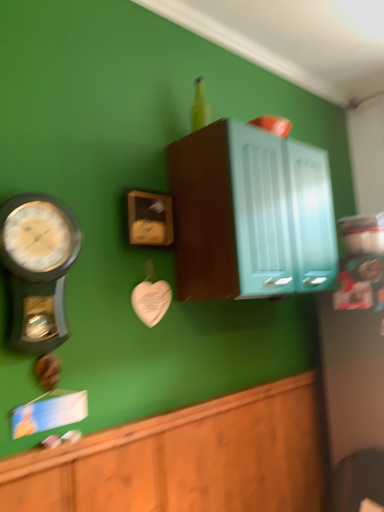
Question: Which direction should I rotate to face teal glossy cabinet at upper center, marked as the 1th cabinetry in a top-to-bottom arrangement, — up or down?

Choices:
 (A) down
 (B) up

Answer: (B)

Question: Considering the relative sizes of metallic silver wall clock at left and teal glossy cabinet at upper center, marked as the 2th cabinetry in a bottom-to-top arrangement, in the image provided, is metallic silver wall clock at left thinner than teal glossy cabinet at upper center, marked as the 2th cabinetry in a bottom-to-top arrangement,?

Choices:
 (A) no
 (B) yes

Answer: (B)

Question: Can you confirm if metallic silver wall clock at left is positioned to the left of teal glossy cabinet at upper center, marked as the 2th cabinetry in a bottom-to-top arrangement?

Choices:
 (A) no
 (B) yes

Answer: (B)

Question: Considering the relative sizes of metallic silver wall clock at left and teal glossy cabinet at upper center, marked as the 2th cabinetry in a bottom-to-top arrangement, in the image provided, is metallic silver wall clock at left taller than teal glossy cabinet at upper center, marked as the 2th cabinetry in a bottom-to-top arrangement,?

Choices:
 (A) yes
 (B) no

Answer: (B)

Question: From a real-world perspective, is metallic silver wall clock at left on teal glossy cabinet at upper center, marked as the 1th cabinetry in a top-to-bottom arrangement?

Choices:
 (A) yes
 (B) no

Answer: (B)

Question: Is metallic silver wall clock at left aimed at teal glossy cabinet at upper center, marked as the 1th cabinetry in a top-to-bottom arrangement?

Choices:
 (A) no
 (B) yes

Answer: (A)

Question: Is the depth of metallic silver wall clock at left greater than that of teal glossy cabinet at upper center, marked as the 1th cabinetry in a top-to-bottom arrangement?

Choices:
 (A) yes
 (B) no

Answer: (B)

Question: Is wooden cabinet at lower center, positioned as the first cabinetry in bottom-to-top order, completely or partially outside of teal glossy cabinet at upper center, marked as the 1th cabinetry in a top-to-bottom arrangement?

Choices:
 (A) no
 (B) yes

Answer: (B)

Question: From the image's perspective, is wooden cabinet at lower center, positioned as the first cabinetry in bottom-to-top order, beneath teal glossy cabinet at upper center, marked as the 2th cabinetry in a bottom-to-top arrangement?

Choices:
 (A) yes
 (B) no

Answer: (A)

Question: Could you tell me if wooden cabinet at lower center, which ranks as the 2th cabinetry in top-to-bottom order, is turned towards teal glossy cabinet at upper center, marked as the 1th cabinetry in a top-to-bottom arrangement?

Choices:
 (A) no
 (B) yes

Answer: (A)

Question: Is wooden cabinet at lower center, which ranks as the 2th cabinetry in top-to-bottom order, closer to camera compared to teal glossy cabinet at upper center, marked as the 2th cabinetry in a bottom-to-top arrangement?

Choices:
 (A) yes
 (B) no

Answer: (A)

Question: Can you confirm if wooden cabinet at lower center, positioned as the first cabinetry in bottom-to-top order, is bigger than teal glossy cabinet at upper center, marked as the 1th cabinetry in a top-to-bottom arrangement?

Choices:
 (A) no
 (B) yes

Answer: (A)

Question: From a real-world perspective, is wooden cabinet at lower center, positioned as the first cabinetry in bottom-to-top order, over teal glossy cabinet at upper center, marked as the 2th cabinetry in a bottom-to-top arrangement?

Choices:
 (A) yes
 (B) no

Answer: (B)

Question: Can you confirm if wooden cabinet at lower center, which ranks as the 2th cabinetry in top-to-bottom order, is taller than wooden clock at center?

Choices:
 (A) no
 (B) yes

Answer: (B)